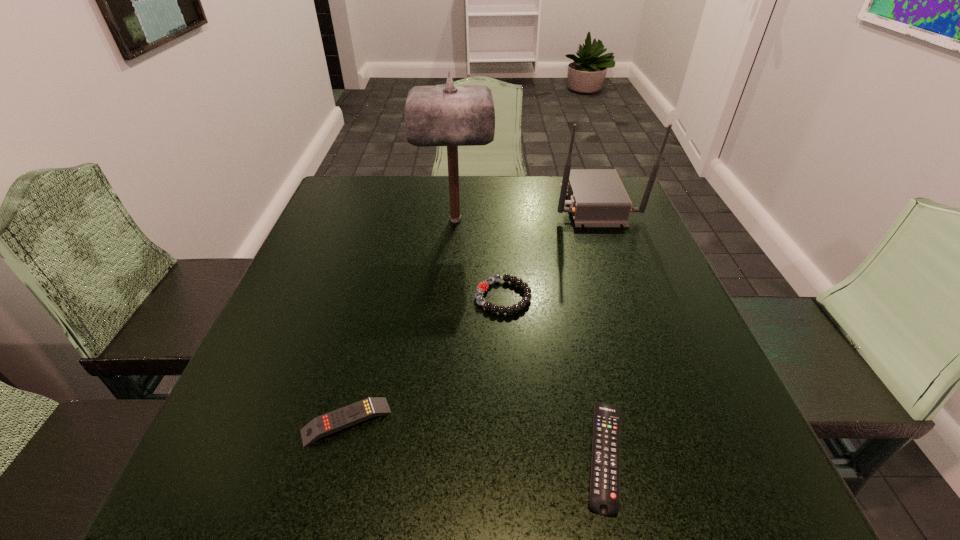
Image resolution: width=960 pixels, height=540 pixels. What are the coordinates of `vacant space located on the right of the left remote control` in the screenshot? It's located at (420, 421).

Locate an element on the screen. The image size is (960, 540). vacant space located 0.070m on the back of the right remote control is located at coordinates (586, 370).

At what (x,y) coordinates should I click in order to perform the action: click on mallet located in the far edge section of the desktop. Please return your answer as a coordinate pair (x, y). The height and width of the screenshot is (540, 960). Looking at the image, I should click on (453, 115).

The height and width of the screenshot is (540, 960). I want to click on router situated at the far edge, so click(x=597, y=198).

At what (x,y) coordinates should I click in order to perform the action: click on object present at the near edge. Please return your answer as a coordinate pair (x, y). This screenshot has height=540, width=960. Looking at the image, I should click on pyautogui.click(x=604, y=499).

Identify the location of object located at the left edge. This screenshot has width=960, height=540. (334, 421).

You are a GUI agent. You are given a task and a screenshot of the screen. Output one action in this format:
    pyautogui.click(x=<x>, y=<y>)
    Task: Click on the object that is at the right edge
    Image resolution: width=960 pixels, height=540 pixels.
    Given the screenshot: What is the action you would take?
    pyautogui.click(x=597, y=198)

Locate an element on the screen. This screenshot has width=960, height=540. object positioned at the far right corner is located at coordinates (597, 198).

The width and height of the screenshot is (960, 540). What are the coordinates of `blank space at the far edge of the desktop` in the screenshot? It's located at (503, 220).

You are a GUI agent. You are given a task and a screenshot of the screen. Output one action in this format:
    pyautogui.click(x=<x>, y=<y>)
    Task: Click on the vacant area at the left edge
    
    Given the screenshot: What is the action you would take?
    pyautogui.click(x=338, y=258)